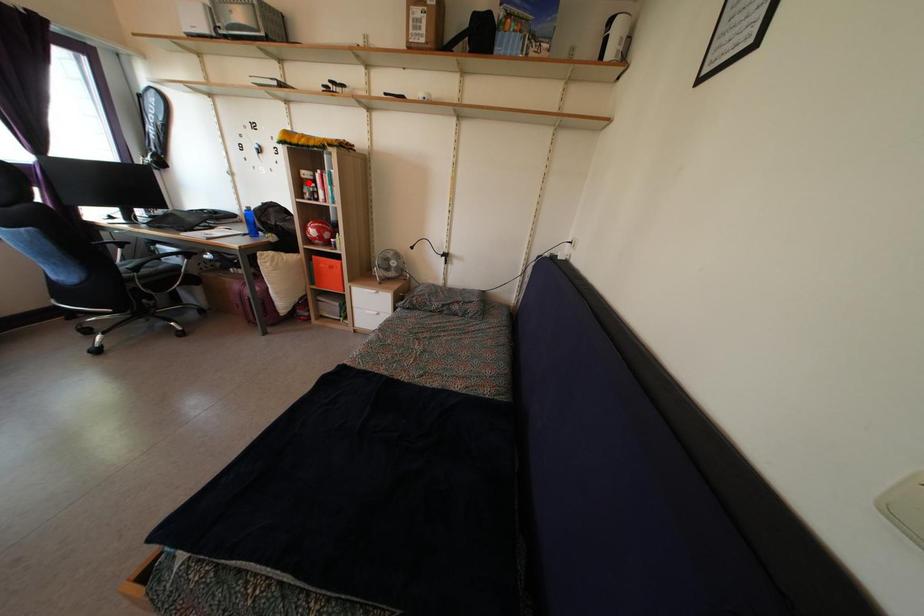
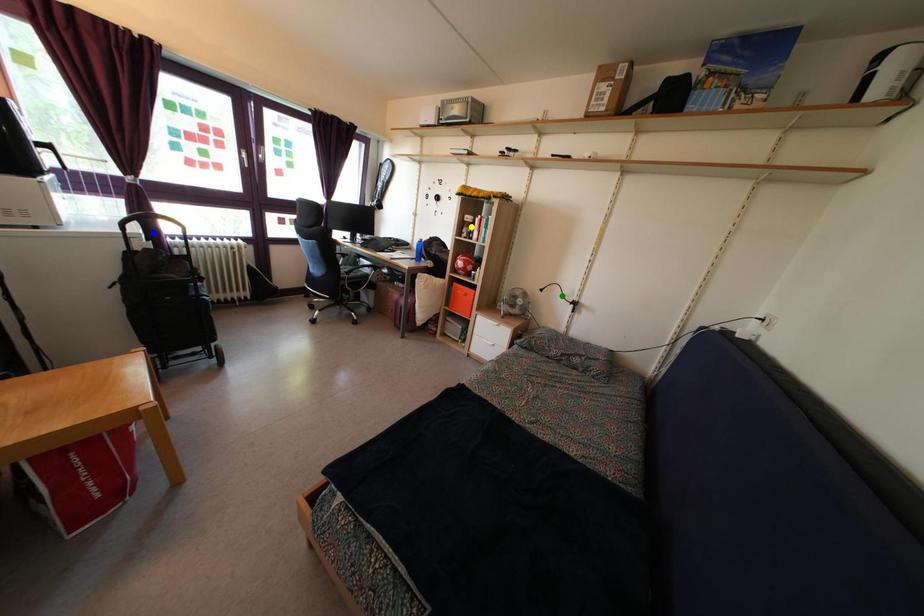
Question: I am providing you with two images of the same scene from different viewpoints. A red point is marked on the first image. You are given multiple points on the second image. Which point in image 2 is actually the same real-world point as the red point in image 1?

Choices:
 (A) blue point
 (B) yellow point
 (C) green point

Answer: (B)